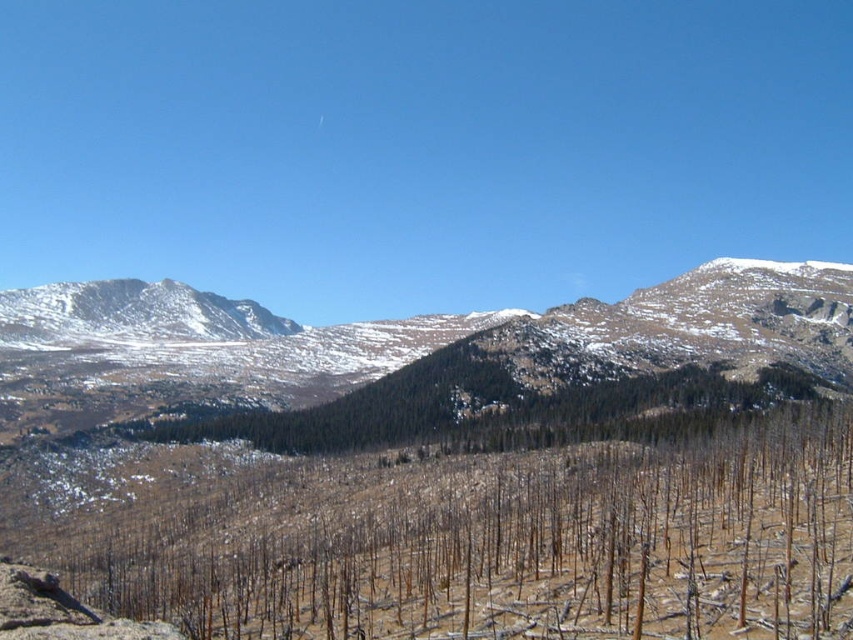
You are a hiker navigating the mountainous landscape. You see two points marked on your map at coordinates point (x=7, y=442) and point (x=103, y=282). Which point is closer to your current position if you are standing at the base of the mountain looking towards the barren area?

Point (x=7, y=442) is in front of point (x=103, y=282), so it is closer to your current position.

Based on the photo, you are a hiker planning to reach the snowy rocky mountain at center. Based on the scene description, what is the most direct path you should take from your current position at the lower left corner of the image?

The most direct path would involve moving towards the snowy rocky mountain at center located at coordinates approximately 0.534 on the x axis and 0.450 on the y axis.